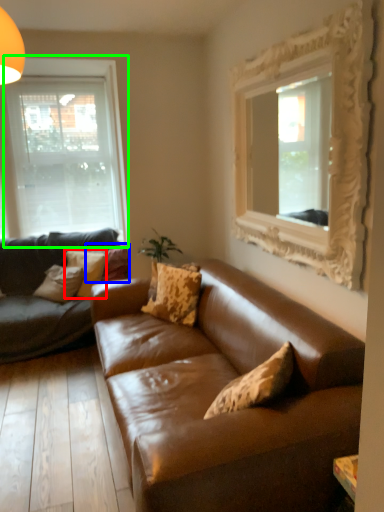
Question: Which object is positioned farthest from pillow (highlighted by a red box)? Select from pillow (highlighted by a blue box) and window (highlighted by a green box).

Choices:
 (A) pillow
 (B) window

Answer: (B)